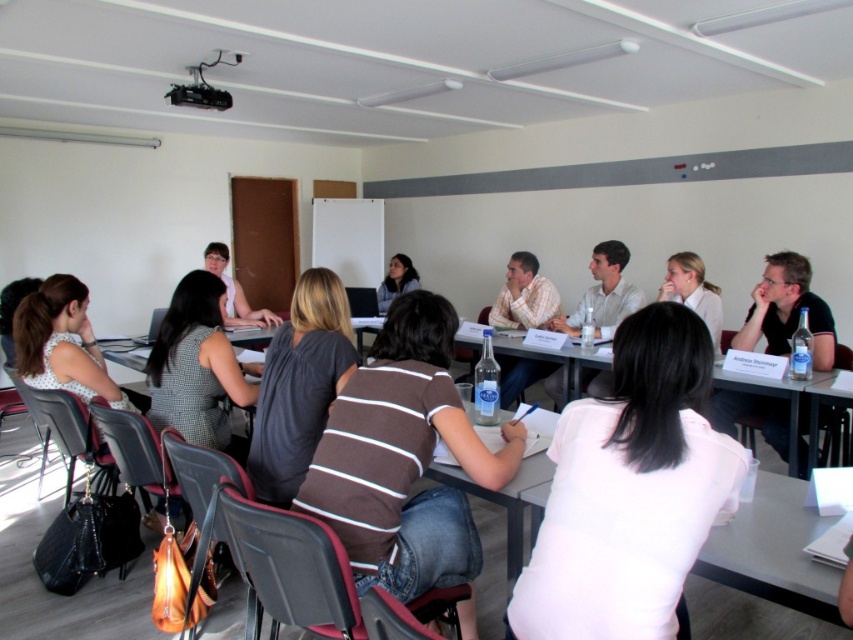
You are sitting at the front of the classroom and notice two people in the center of the room wearing a light beige shirt at center and a plaid cotton shirt at center. Which one is positioned more to the right?

The light beige shirt at center is positioned to the right of the plaid cotton shirt at center, so the light beige shirt at center is more to the right.

You are sitting at the front of the classroom and want to move to the back. Which point should you walk towards first, point (784, 349) or point (498, 385)?

You should walk towards point (498, 385) first because point (784, 349) is in front of point (498, 385), meaning point (498, 385) is behind point (784, 349).

Where is the plaid cotton shirt at center located in the classroom?

The plaid cotton shirt at center is located at the coordinates point [524,296] in the classroom.